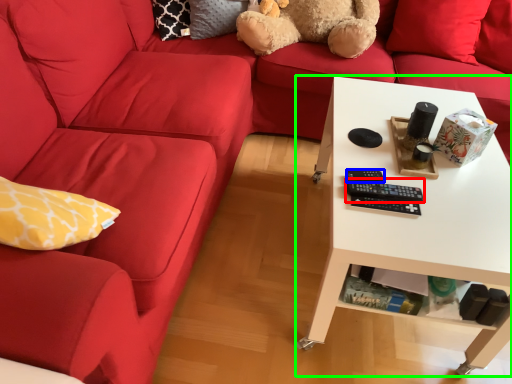
Question: Based on their relative distances, which object is nearer to control (highlighted by a red box)? Choose from control (highlighted by a blue box) and table (highlighted by a green box).

Choices:
 (A) control
 (B) table

Answer: (A)